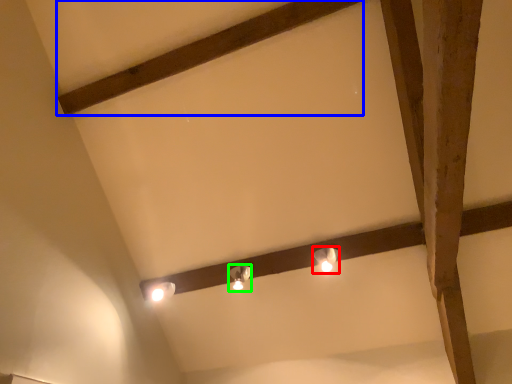
Question: Estimate the real-world distances between objects in this image. Which object is farther from lamp (highlighted by a red box), plank (highlighted by a blue box) or lamp (highlighted by a green box)?

Choices:
 (A) plank
 (B) lamp

Answer: (A)